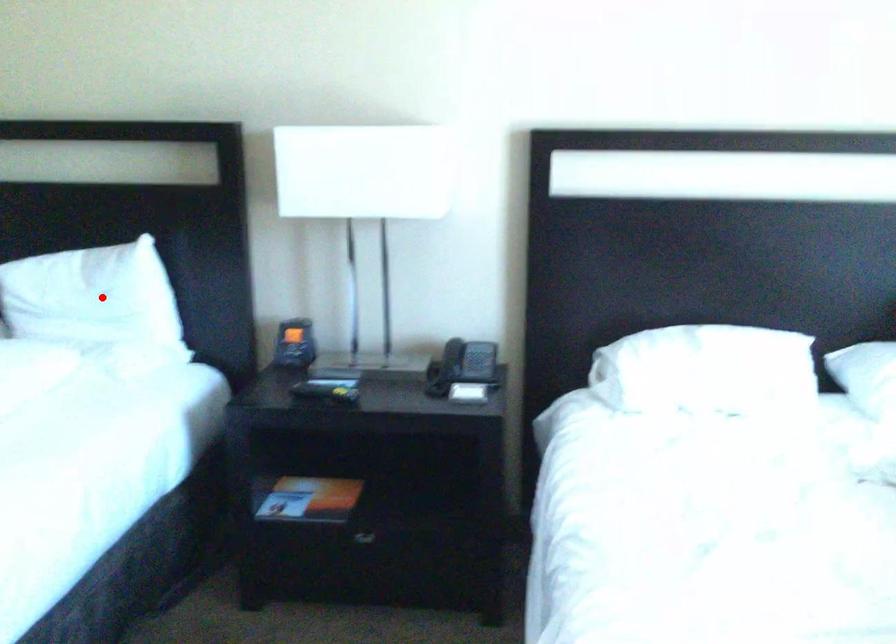
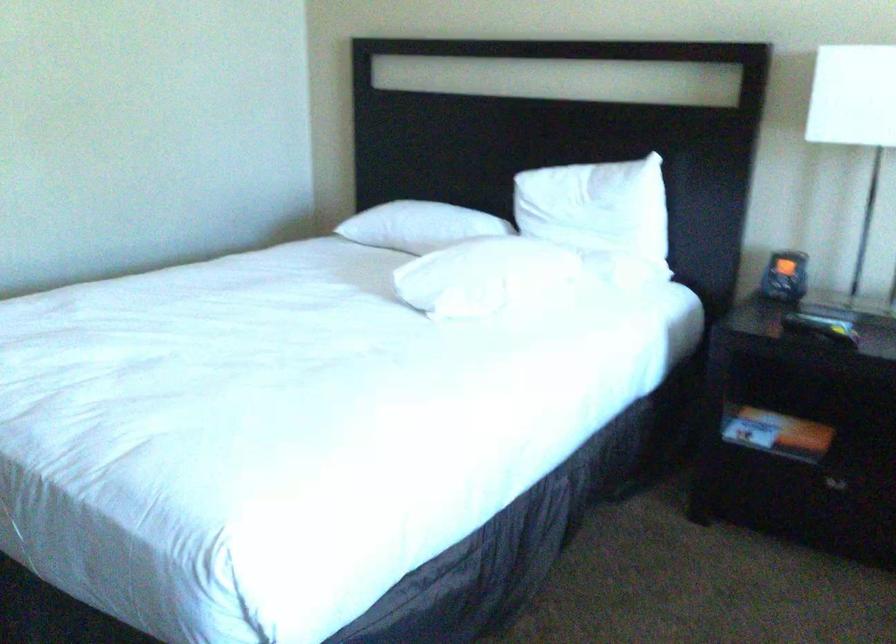
Where in the second image is the point corresponding to the highlighted location from the first image?

(598, 209)